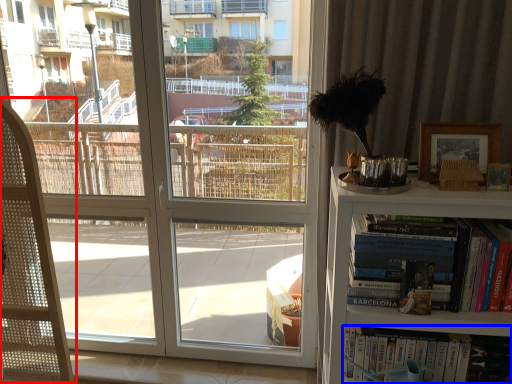
Question: Which point is closer to the camera, folding chair (highlighted by a red box) or book (highlighted by a blue box)?

Choices:
 (A) folding chair
 (B) book

Answer: (A)